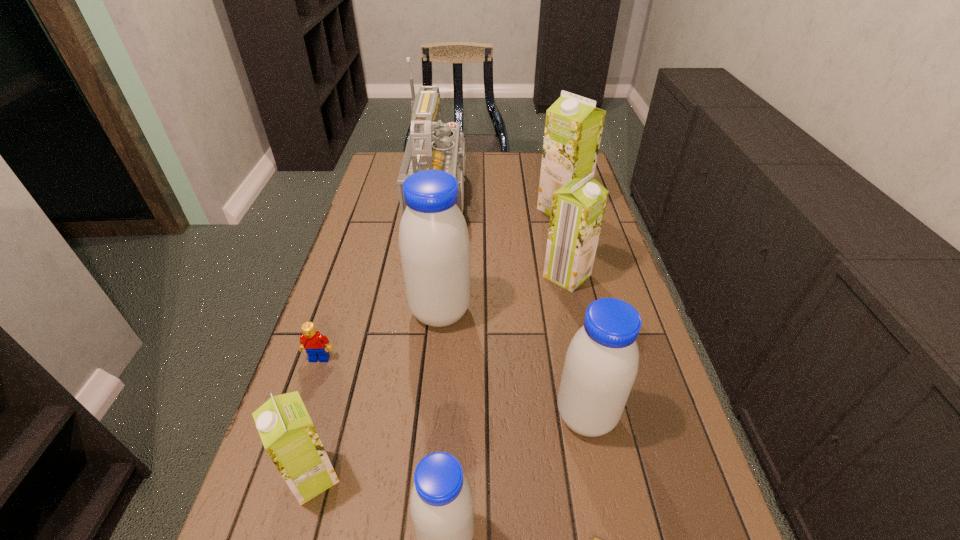
I want to click on the eighth tallest object, so click(x=312, y=341).

The width and height of the screenshot is (960, 540). Find the location of `vacant space positioned on the front-facing side of the radio receiver`. vacant space positioned on the front-facing side of the radio receiver is located at coordinates (537, 198).

At what (x,y) coordinates should I click in order to perform the action: click on vacant space situated 0.400m on the front of the farthest soya milk. Please return your answer as a coordinate pair (x, y). The image size is (960, 540). Looking at the image, I should click on (588, 316).

The image size is (960, 540). I want to click on vacant space situated on the right of the biggest blue soya milk, so click(538, 312).

This screenshot has height=540, width=960. Find the location of `free space located on the left of the second farthest green soya milk`. free space located on the left of the second farthest green soya milk is located at coordinates (460, 275).

This screenshot has width=960, height=540. Find the location of `vacant space located 0.050m on the back of the rightmost blue soya milk`. vacant space located 0.050m on the back of the rightmost blue soya milk is located at coordinates (577, 371).

Locate an element on the screen. Image resolution: width=960 pixels, height=540 pixels. free location located on the back of the seventh farthest object is located at coordinates (332, 409).

Locate an element on the screen. Image resolution: width=960 pixels, height=540 pixels. free region located on the front-facing side of the second shortest object is located at coordinates (264, 526).

The width and height of the screenshot is (960, 540). Find the location of `object that is positioned at the far edge`. object that is positioned at the far edge is located at coordinates (431, 145).

I want to click on radio receiver that is at the left edge, so pos(431,145).